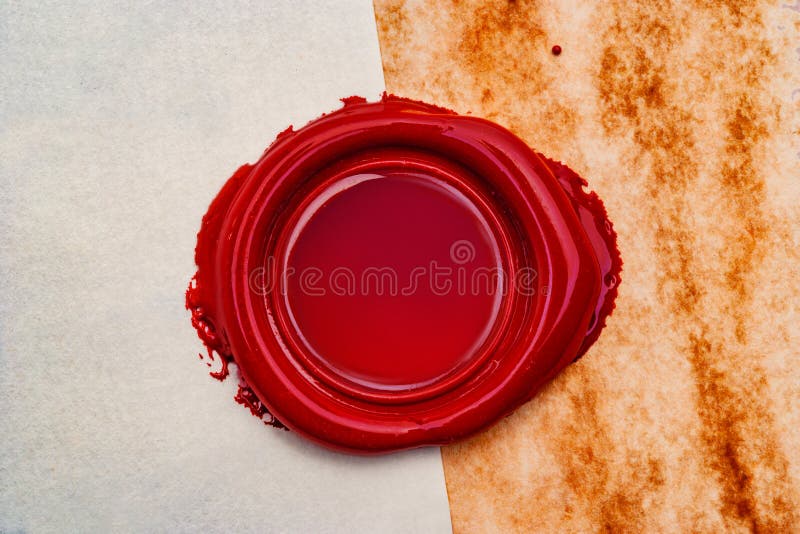
You are a GUI agent. You are given a task and a screenshot of the screen. Output one action in this format:
    pyautogui.click(x=<x>, y=<y>)
    Task: Click on the red paint
    The width and height of the screenshot is (800, 534).
    Given the screenshot: What is the action you would take?
    pyautogui.click(x=572, y=294), pyautogui.click(x=270, y=348), pyautogui.click(x=341, y=280), pyautogui.click(x=309, y=277), pyautogui.click(x=258, y=277), pyautogui.click(x=522, y=274)